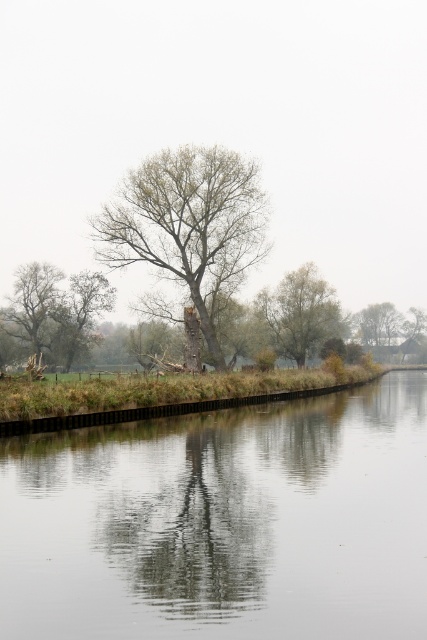
Question: Is smooth concrete river at center to the left of green leafy tree at center from the viewer's perspective?

Choices:
 (A) yes
 (B) no

Answer: (B)

Question: Which of these objects is positioned closest to the green matte tree at center?

Choices:
 (A) smooth concrete river at center
 (B) green leafy tree at center
 (C) green leafy tree at left

Answer: (B)

Question: Does smooth concrete river at center lie behind green leafy tree at left?

Choices:
 (A) no
 (B) yes

Answer: (A)

Question: From the image, what is the correct spatial relationship of smooth concrete river at center in relation to green leafy tree at center?

Choices:
 (A) above
 (B) below

Answer: (B)

Question: Which point appears closest to the camera in this image?

Choices:
 (A) (236, 636)
 (B) (324, 326)

Answer: (A)

Question: Which point is closer to the camera?

Choices:
 (A) smooth concrete river at center
 (B) green leafy tree at left
 (C) green matte tree at center

Answer: (A)